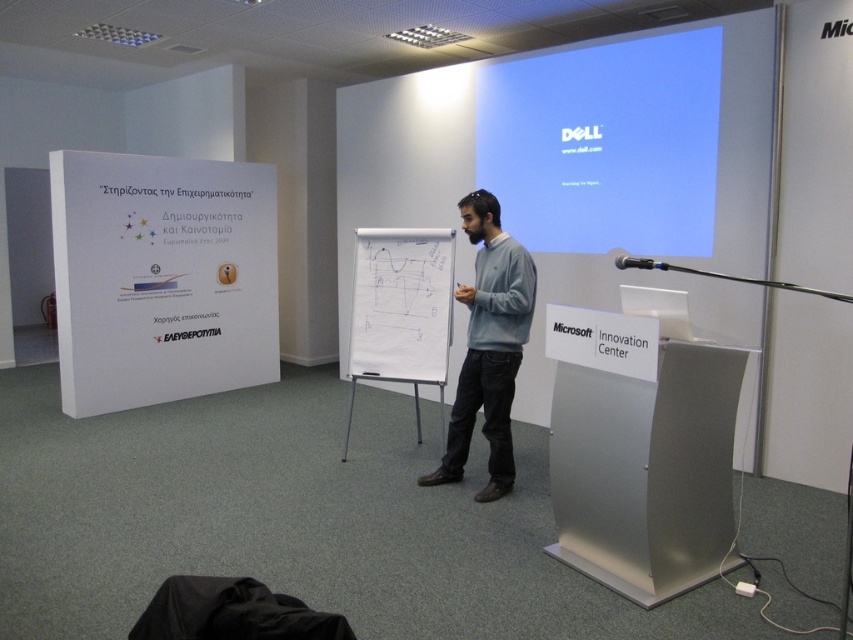
Question: Which point is closer to the camera?

Choices:
 (A) (215, 364)
 (B) (665, 122)
 (C) (635, 424)
 (D) (495, 246)

Answer: (C)

Question: Which of these objects is positioned closest to the silver metallic podium at center?

Choices:
 (A) white paperboard at left
 (B) white glossy projection screen at upper center

Answer: (B)

Question: From the image, what is the correct spatial relationship of white glossy projection screen at upper center in relation to gray cotton sweater at center?

Choices:
 (A) right
 (B) left

Answer: (A)

Question: Does white paperboard at left have a larger size compared to gray cotton sweater at center?

Choices:
 (A) no
 (B) yes

Answer: (B)

Question: Which point appears farthest from the camera in this image?

Choices:
 (A) (479, 358)
 (B) (650, 513)

Answer: (A)

Question: Is white glossy projection screen at upper center to the left of gray cotton sweater at center from the viewer's perspective?

Choices:
 (A) no
 (B) yes

Answer: (A)